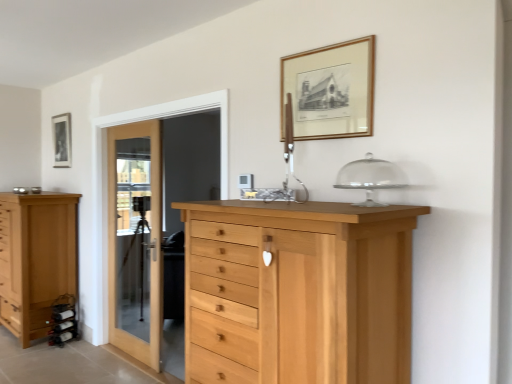
Question: Does light brown wooden chest of drawers at left, acting as the second chest of drawers starting from the front, have a greater width compared to natural wood chest of drawers at center, which is counted as the first chest of drawers, starting from the right?

Choices:
 (A) yes
 (B) no

Answer: (B)

Question: Can you confirm if light brown wooden chest of drawers at left, placed as the 1th chest of drawers when sorted from back to front, is positioned to the right of natural wood chest of drawers at center, marked as the 1th chest of drawers in a front-to-back arrangement?

Choices:
 (A) no
 (B) yes

Answer: (A)

Question: Can you confirm if light brown wooden chest of drawers at left, the first chest of drawers when ordered from left to right, is smaller than natural wood chest of drawers at center, the second chest of drawers viewed from the left?

Choices:
 (A) no
 (B) yes

Answer: (A)

Question: Does light brown wooden chest of drawers at left, the first chest of drawers when ordered from left to right, lie behind natural wood chest of drawers at center, the second chest of drawers viewed from the left?

Choices:
 (A) no
 (B) yes

Answer: (B)

Question: Is light brown wooden chest of drawers at left, acting as the second chest of drawers starting from the right, to the left of natural wood chest of drawers at center, marked as the 1th chest of drawers in a front-to-back arrangement, from the viewer's perspective?

Choices:
 (A) no
 (B) yes

Answer: (B)

Question: Looking at their shapes, would you say matte black picture frame at upper left, the second picture frame positioned from the right, is wider or thinner than natural wood chest of drawers at center, which is counted as the first chest of drawers, starting from the right?

Choices:
 (A) wide
 (B) thin

Answer: (B)

Question: Would you say matte black picture frame at upper left, the second picture frame positioned from the right, is to the left or to the right of natural wood chest of drawers at center, the 2th chest of drawers from the back, in the picture?

Choices:
 (A) left
 (B) right

Answer: (A)

Question: From a real-world perspective, is matte black picture frame at upper left, the 1th picture frame from the back, physically located above or below natural wood chest of drawers at center, the 2th chest of drawers from the back?

Choices:
 (A) below
 (B) above

Answer: (B)

Question: Does point (70, 127) appear closer or farther from the camera than point (357, 337)?

Choices:
 (A) farther
 (B) closer

Answer: (A)

Question: From a real-world perspective, relative to natural wood chest of drawers at center, which is counted as the first chest of drawers, starting from the right, is light brown wooden chest of drawers at left, placed as the 1th chest of drawers when sorted from back to front, vertically above or below?

Choices:
 (A) above
 (B) below

Answer: (B)

Question: Relative to natural wood chest of drawers at center, the second chest of drawers viewed from the left, is light brown wooden chest of drawers at left, acting as the second chest of drawers starting from the front, in front or behind?

Choices:
 (A) front
 (B) behind

Answer: (B)

Question: Looking at the image, does light brown wooden chest of drawers at left, placed as the 1th chest of drawers when sorted from back to front, seem bigger or smaller compared to natural wood chest of drawers at center, which is counted as the first chest of drawers, starting from the right?

Choices:
 (A) small
 (B) big

Answer: (B)

Question: Is light brown wooden chest of drawers at left, acting as the second chest of drawers starting from the front, taller or shorter than natural wood chest of drawers at center, which is counted as the first chest of drawers, starting from the right?

Choices:
 (A) tall
 (B) short

Answer: (A)

Question: Does point (354, 72) appear closer or farther from the camera than point (150, 144)?

Choices:
 (A) farther
 (B) closer

Answer: (B)

Question: Considering their positions, is gold wooden picture frame at upper center, the 1th picture frame from the front, located in front of or behind clear glass door at center?

Choices:
 (A) front
 (B) behind

Answer: (A)